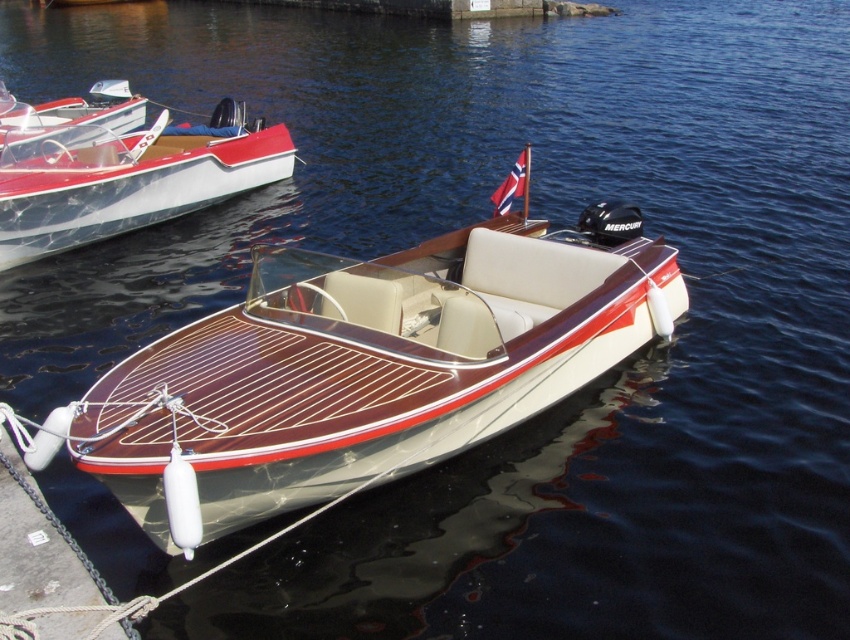
You are standing on the dock and want to board the wooden boat at center. Which direction should you walk to avoid the shiny white boat at left?

The wooden boat at center is in front of the shiny white boat at left, so you should walk towards the direction away from the shiny white boat at left to board the wooden boat at center without obstruction.

You are standing on the dock looking at the motorboat. There are two points marked on the boat. One is at coordinates point (221,497) and the other is at point (6,248). Which point is closer to you?

Point (221,497) is closer to the camera than point (6,248).

You are planning to board a boat and need to choose between the wooden boat at center and the shiny metallic boat at upper left. Based on their sizes, which boat would you recommend for a group of 6 people?

The wooden boat at center has a larger size compared to the shiny metallic boat at upper left, so it would be more suitable for accommodating a group of 6 people.